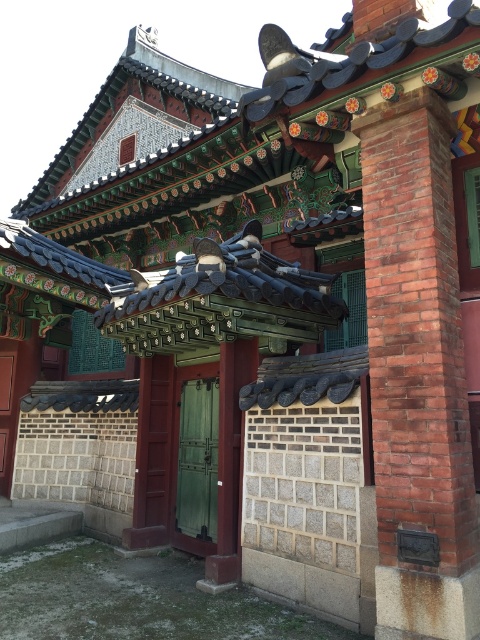
Between red brick pillar at right and green wooden door at center, which one is positioned higher?

red brick pillar at right is above.

Image resolution: width=480 pixels, height=640 pixels. Find the location of `red brick pillar at right`. red brick pillar at right is located at coordinates (418, 374).